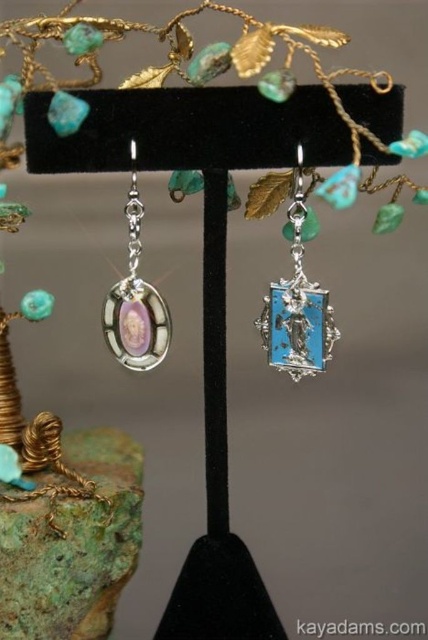
Question: Which point is closer to the camera?

Choices:
 (A) (76, 438)
 (B) (116, 289)

Answer: (B)

Question: Which point appears farthest from the camera in this image?

Choices:
 (A) (47, 620)
 (B) (128, 314)

Answer: (A)

Question: Does green patina stone at lower left appear on the left side of turquoise enamel angel at center?

Choices:
 (A) yes
 (B) no

Answer: (A)

Question: Among these points, which one is farthest from the camera?

Choices:
 (A) (74, 442)
 (B) (309, 365)

Answer: (A)

Question: Can you confirm if turquoise enamel angel at center is wider than matte silver oval at left?

Choices:
 (A) yes
 (B) no

Answer: (A)

Question: Where is green patina stone at lower left located in relation to turquoise enamel angel at center in the image?

Choices:
 (A) above
 (B) below

Answer: (B)